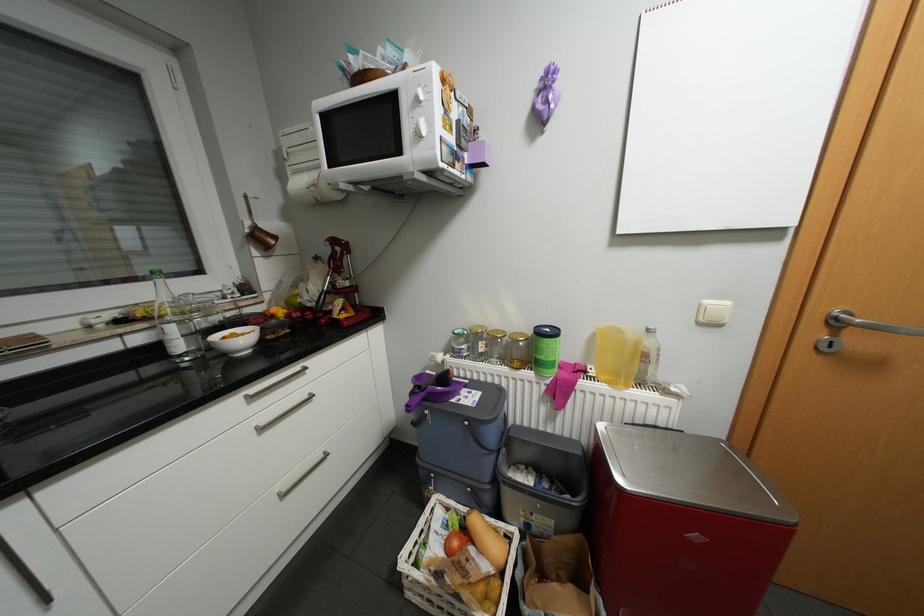
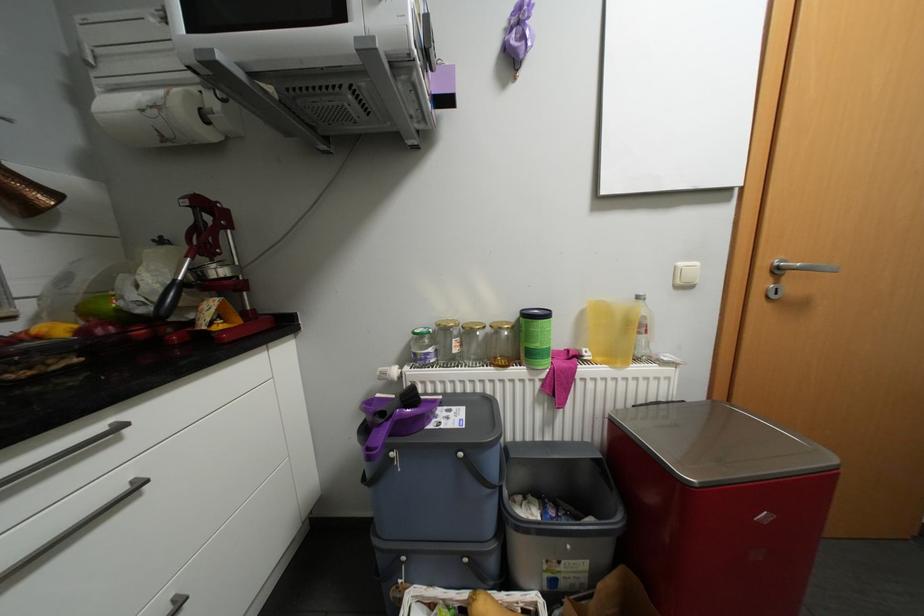
Which direction would the cameraman need to move to produce the second image?

The movement direction of the cameraman is left, forward.